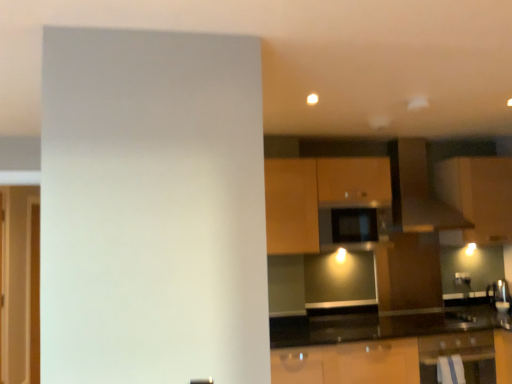
Question: Does point (502, 205) appear closer or farther from the camera than point (479, 379)?

Choices:
 (A) farther
 (B) closer

Answer: (A)

Question: Is matte brown cabinet at upper right, the 3th cabinetry from the left, in front of or behind metallic silver oven at lower right in the image?

Choices:
 (A) behind
 (B) front

Answer: (A)

Question: Which object is the farthest from the metallic silver oven at lower right?

Choices:
 (A) black matte microwave at center
 (B) matte brown cabinet at center, marked as the second cabinetry in a left-to-right arrangement
 (C) matte brown cabinet at upper right, the 3th cabinetry from the left
 (D) wooden cabinet at center, the 1th cabinetry from the left
 (E) transparent glass door at left

Answer: (E)

Question: Considering the real-world distances, which object is farthest from the metallic silver oven at lower right?

Choices:
 (A) black matte microwave at center
 (B) matte brown exhaust hood at upper center
 (C) matte brown cabinet at center, which is counted as the 2th cabinetry, starting from the right
 (D) wooden cabinet at center, the 1th cabinetry from the left
 (E) transparent glass door at left

Answer: (E)